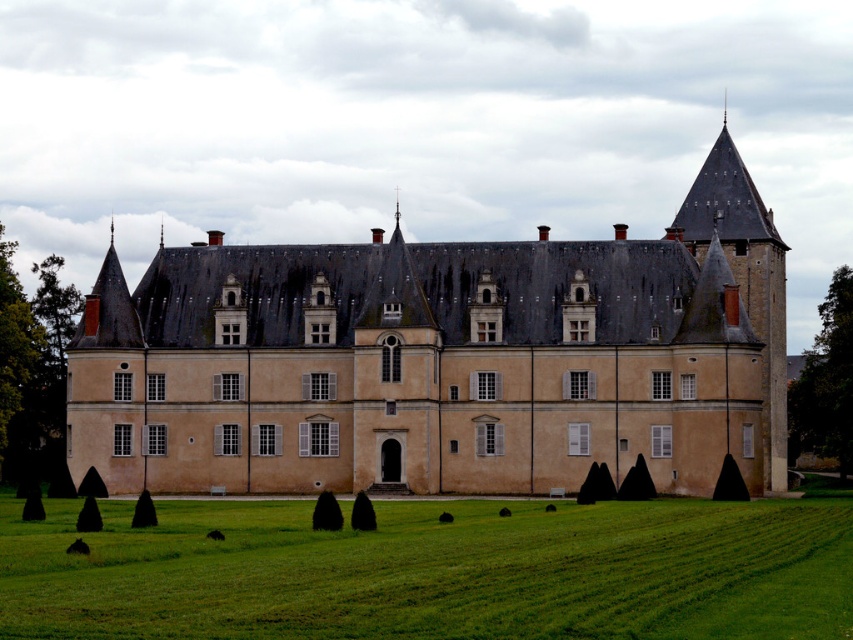
Does point (585, 454) come in front of point (840, 292)?

Yes, it is.

Who is more forward, (177, 454) or (827, 417)?

Point (177, 454) is more forward.

Where is `beige stone castle at center`? beige stone castle at center is located at coordinates (444, 358).

Identify the location of beige stone castle at center. The width and height of the screenshot is (853, 640). (444, 358).

In the scene shown: Between beige stone castle at center and green leafy tree at left, which one has less height?

Standing shorter between the two is green leafy tree at left.

Is point (567, 490) positioned before point (0, 419)?

Yes.

Where is `beige stone castle at center`? The height and width of the screenshot is (640, 853). beige stone castle at center is located at coordinates (444, 358).

Is point (357, 266) farther from viewer compared to point (71, 520)?

Yes, it is.

You are a GUI agent. You are given a task and a screenshot of the screen. Output one action in this format:
    pyautogui.click(x=<x>, y=<y>)
    Task: Click on the beige stone castle at center
    This screenshot has height=640, width=853.
    Given the screenshot: What is the action you would take?
    pyautogui.click(x=444, y=358)